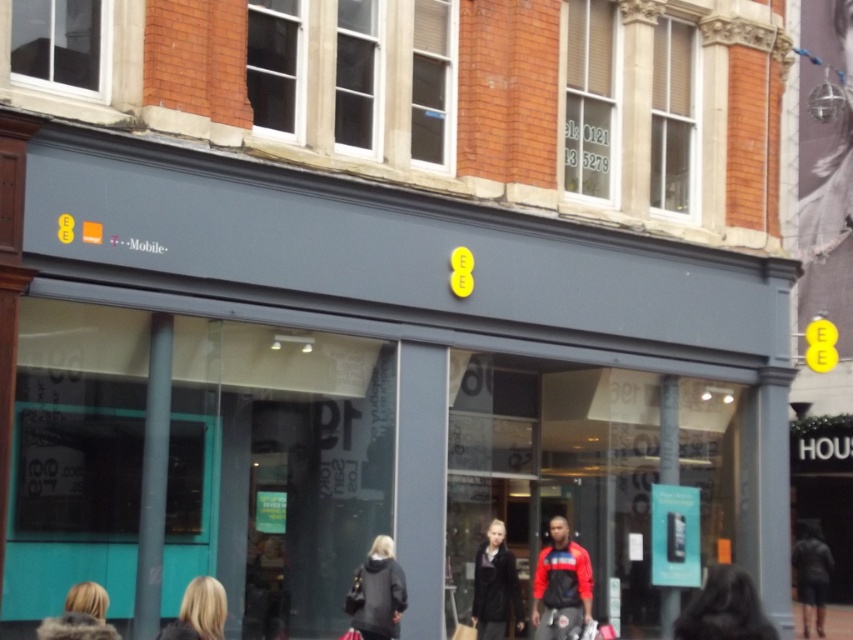
Question: Can you confirm if blonde fur coat at lower left is positioned to the right of blonde hair at lower center?

Choices:
 (A) no
 (B) yes

Answer: (A)

Question: Based on their relative distances, which object is farther from the blonde hair at lower center?

Choices:
 (A) red fleece jacket at center
 (B) blonde fur coat at lower left

Answer: (A)

Question: Among these objects, which one is nearest to the camera?

Choices:
 (A) dark gray fur at lower right
 (B) dark gray coat at center
 (C) blonde hair at lower center
 (D) dark gray coat at lower center

Answer: (A)

Question: Considering the relative positions of dark gray coat at lower center and blonde fur coat at lower left in the image provided, where is dark gray coat at lower center located with respect to blonde fur coat at lower left?

Choices:
 (A) above
 (B) below

Answer: (B)

Question: Which of the following is the farthest from the observer?

Choices:
 (A) blonde hair at lower center
 (B) red fleece jacket at center

Answer: (B)

Question: Does dark gray jacket at lower right appear over blonde fur coat at lower left?

Choices:
 (A) no
 (B) yes

Answer: (A)